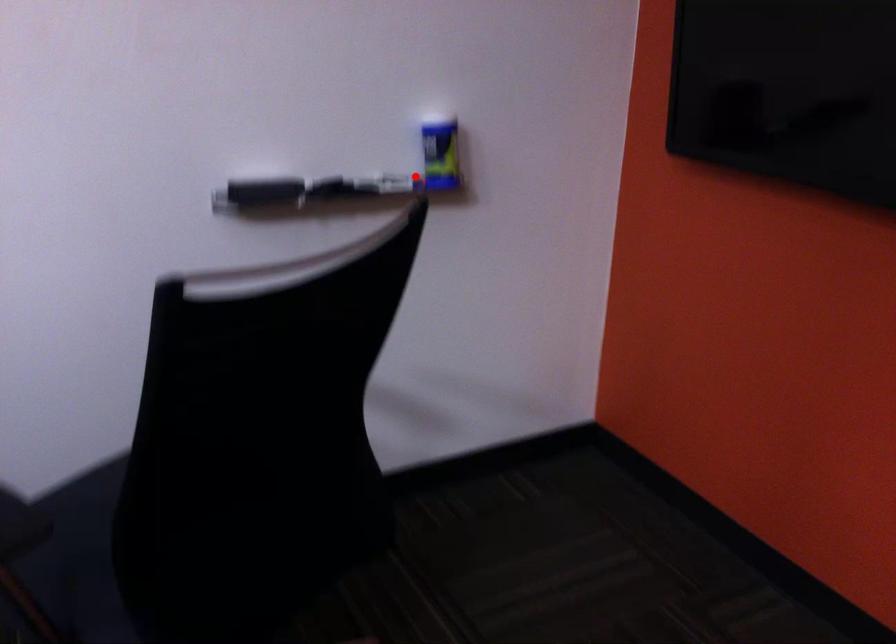
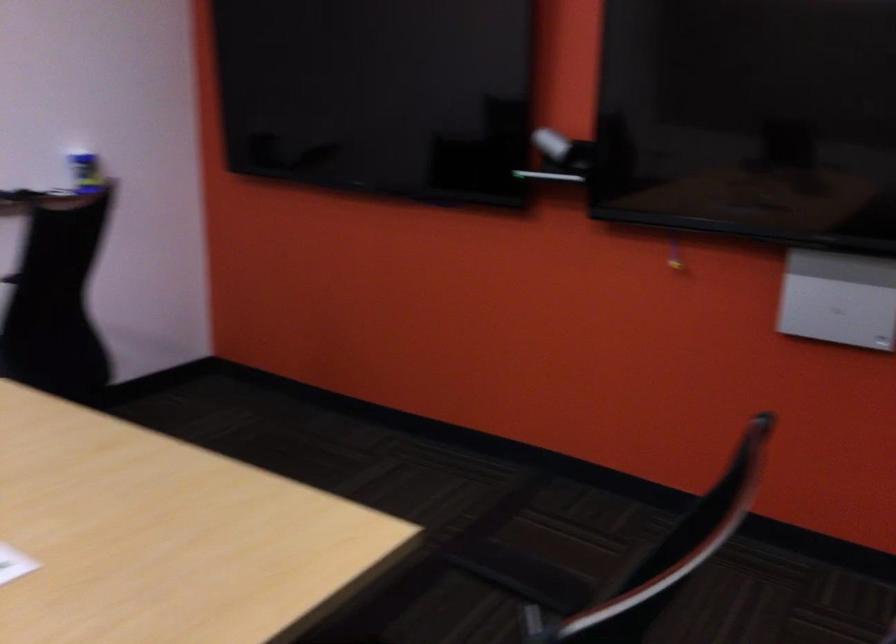
Question: I am providing you with two images of the same scene from different viewpoints. Given a red point in image1, look at the same physical point in image2. Is it:

Choices:
 (A) Closer to the viewpoint
 (B) Farther from the viewpoint

Answer: (B)